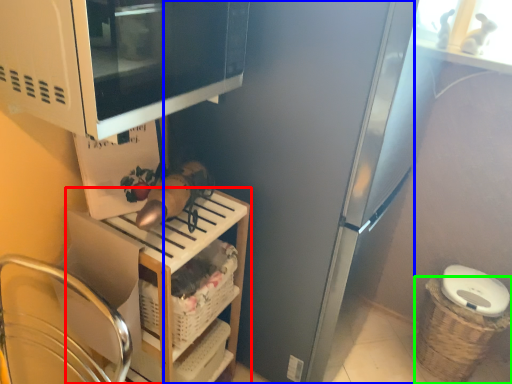
Question: Which object is the closest to the shelf (highlighted by a red box)? Choose among these: appliance (highlighted by a blue box) or basket (highlighted by a green box).

Choices:
 (A) appliance
 (B) basket

Answer: (A)